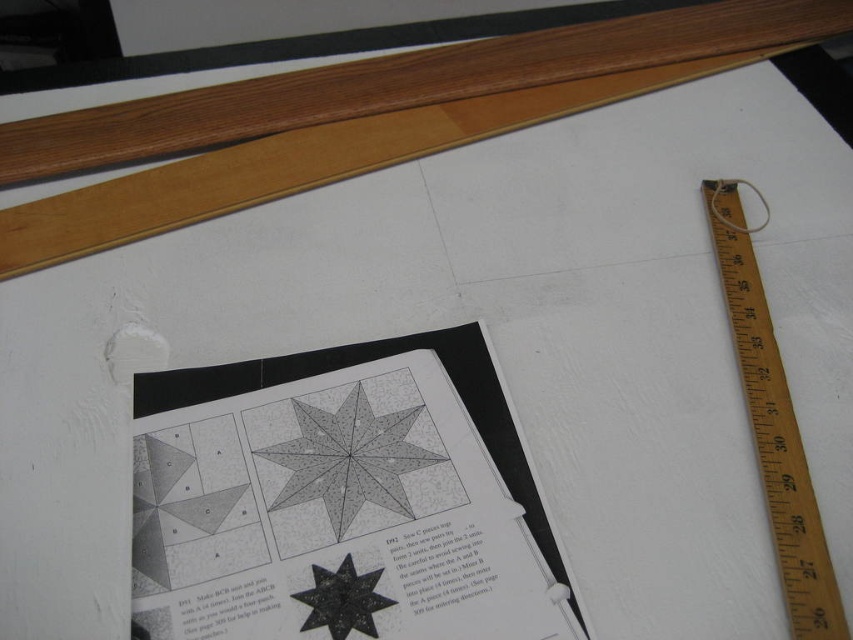
Can you confirm if wooden ruler at right is smaller than black matte star at center?

Incorrect, wooden ruler at right is not smaller in size than black matte star at center.

Does point (764, 352) come behind point (378, 573)?

Yes, point (764, 352) is farther from viewer.

Is point (808, 541) farther from camera compared to point (376, 632)?

Yes, it is.

Image resolution: width=853 pixels, height=640 pixels. Find the location of `wooden ruler at right`. wooden ruler at right is located at coordinates (773, 424).

Which is in front, point (576, 630) or point (361, 397)?

Point (576, 630) is more forward.

Which is in front, point (409, 368) or point (393, 442)?

Point (393, 442) is in front.

This screenshot has width=853, height=640. I want to click on gray paper at center, so click(x=341, y=490).

Can you confirm if gray paper at center is shorter than wooden ruler at right?

Yes.

Between gray paper at center and wooden ruler at right, which one is positioned higher?

wooden ruler at right

Is point (387, 497) closer to viewer compared to point (776, 525)?

That is False.

Find the location of a particular element. gray paper at center is located at coordinates (341, 490).